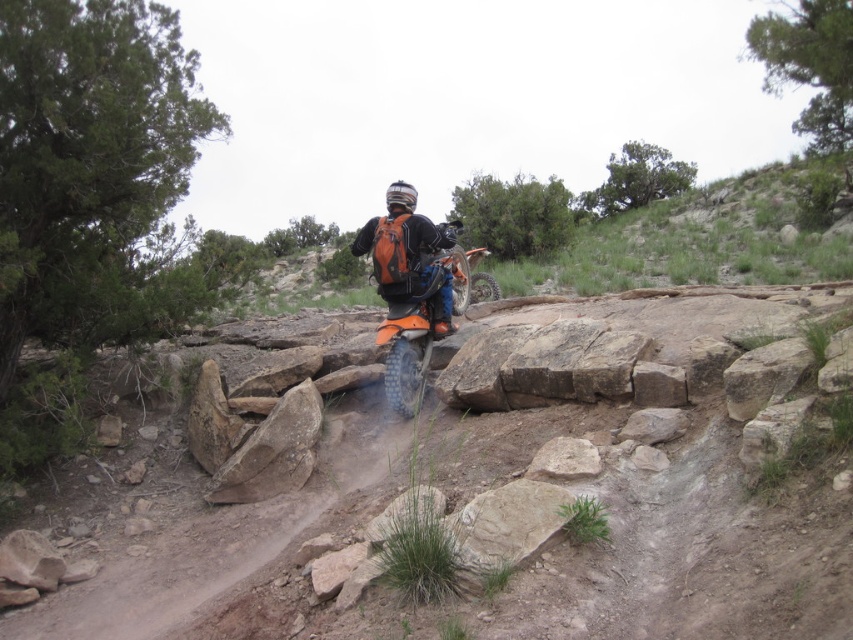
You are planning to hike along the trail and need to carry your orange matte backpack at center. Considering the terrain described, will the dusty gravel dirt track at center provide enough space for you to walk comfortably while carrying the backpack?

The dusty gravel dirt track at center has a larger size compared to the orange matte backpack at center, so yes, the track should provide sufficient space for comfortable hiking while carrying the backpack.

You are a hiker planning to cross the trail. You have an orange matte backpack at center and need to place it on the dusty gravel dirt track at center. Will the backpack fit on the track without overhanging the edges?

The dusty gravel dirt track at center has a lesser height compared to orange matte backpack at center, meaning the backpack is taller. Therefore, the backpack might overhang the edges of the track when placed there.

You are an offroad rider who wants to place your orange matte backpack at center on your orange matte dirt bike at center. According to the scene, where should you place it so that the backpack stays secure?

The orange matte backpack at center should be placed on top of the orange matte dirt bike at center since the dirt bike is below the backpack in the scene.